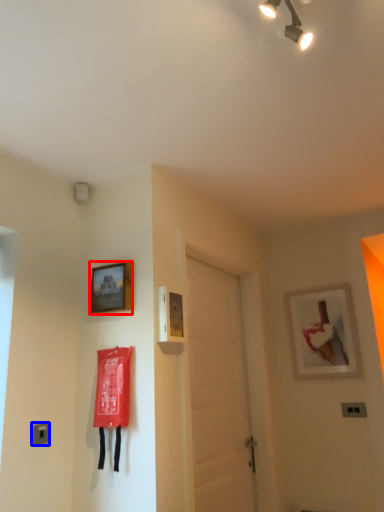
Question: Among these objects, which one is farthest to the camera, picture frame (highlighted by a red box) or light switch (highlighted by a blue box)?

Choices:
 (A) picture frame
 (B) light switch

Answer: (A)